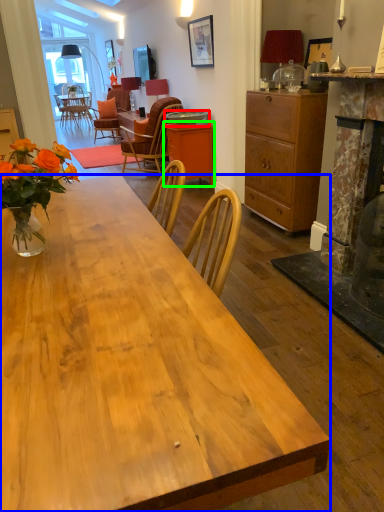
Question: Which object is the closest to the round table (highlighted by a red box)? Choose among these: desk (highlighted by a blue box) or cabinetry (highlighted by a green box).

Choices:
 (A) desk
 (B) cabinetry

Answer: (B)